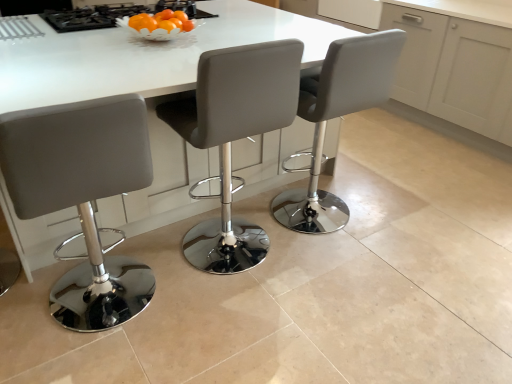
Question: From the image's perspective, is matte gray stool at center, the 2th chair when ordered from left to right, above or below white glossy table at center?

Choices:
 (A) below
 (B) above

Answer: (A)

Question: Would you say matte gray stool at center, the 2th chair when ordered from right to left, is inside or outside white glossy table at center?

Choices:
 (A) inside
 (B) outside

Answer: (A)

Question: Which object is the farthest from the black glass gas stove at upper center?

Choices:
 (A) white glossy table at center
 (B) white matte cabinet at upper center
 (C) matte gray stool at center, acting as the first chair starting from the left
 (D) matte gray stool at center, the 2th chair when ordered from right to left
 (E) white leather stool at center, placed as the third chair when sorted from left to right

Answer: (B)

Question: Based on their relative distances, which object is nearer to the black glass gas stove at upper center?

Choices:
 (A) white matte cabinet at upper center
 (B) white leather stool at center, the first chair from the right
 (C) matte gray stool at center, the 2th chair when ordered from left to right
 (D) white glossy table at center
 (E) matte gray stool at center, acting as the first chair starting from the left

Answer: (D)